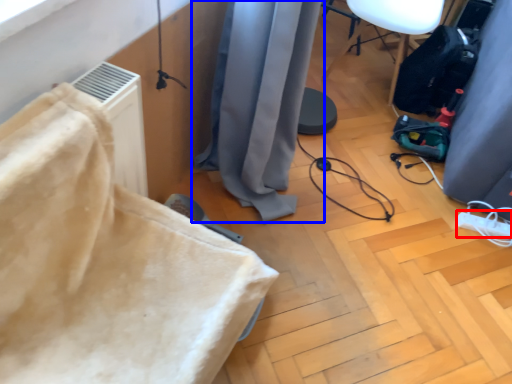
Question: Which of the following is the closest to the observer, extension cord (highlighted by a red box) or curtain (highlighted by a blue box)?

Choices:
 (A) extension cord
 (B) curtain

Answer: (B)